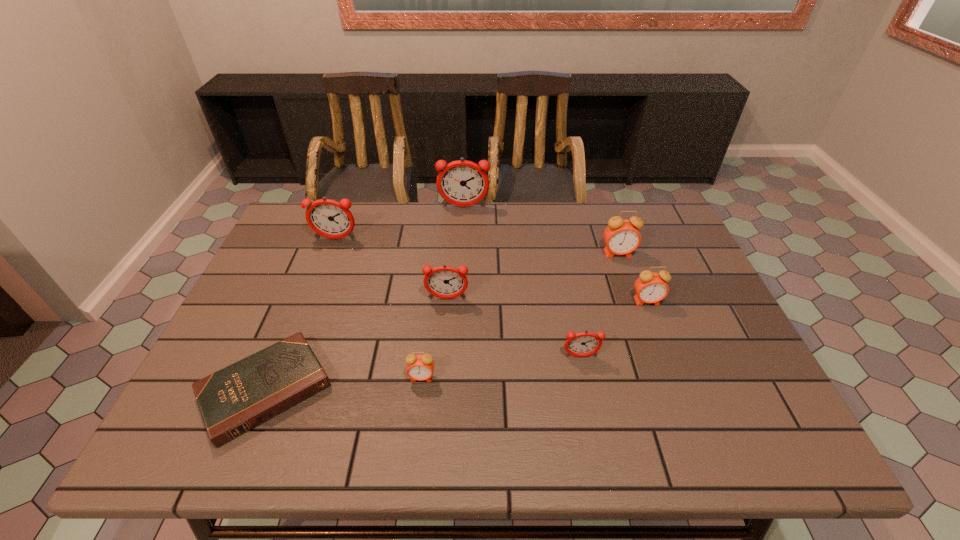
Identify the location of the tallest alarm clock. The image size is (960, 540). (463, 183).

Locate an element on the screen. the biggest reddish-pink alarm clock is located at coordinates (463, 183).

At what (x,y) coordinates should I click in order to perform the action: click on the leftmost alarm clock. Please return your answer as a coordinate pair (x, y). Looking at the image, I should click on (328, 218).

You are a GUI agent. You are given a task and a screenshot of the screen. Output one action in this format:
    pyautogui.click(x=<x>, y=<y>)
    Task: Click on the third smallest reddish-pink alarm clock
    The image size is (960, 540).
    Given the screenshot: What is the action you would take?
    pyautogui.click(x=328, y=218)

Where is `the third farthest alarm clock`? This screenshot has width=960, height=540. the third farthest alarm clock is located at coordinates [621, 236].

Find the location of a particular element. the sixth nearest object is located at coordinates (621, 236).

Where is `the second biggest pink alarm clock`? Image resolution: width=960 pixels, height=540 pixels. the second biggest pink alarm clock is located at coordinates (650, 287).

Locate an element on the screen. This screenshot has width=960, height=540. the second smallest reddish-pink alarm clock is located at coordinates (445, 282).

Locate an element on the screen. The image size is (960, 540). the nearest reddish-pink alarm clock is located at coordinates (582, 344).

The width and height of the screenshot is (960, 540). I want to click on the third alarm clock from right to left, so click(582, 344).